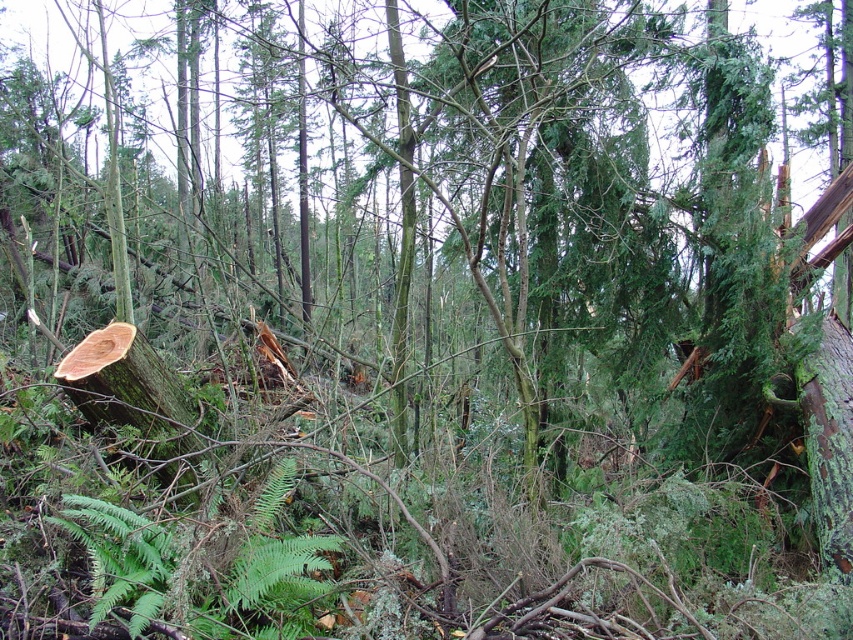
You are a hiker who has just entered the forest and sees the green rough tree trunk at lower left and the green rough bark tree trunk at right. Which tree trunk is positioned lower in the image?

The green rough tree trunk at lower left is positioned lower than the green rough bark tree trunk at right.

What is the relationship in size between the green fuzzy fern at center and the green rough tree trunk at lower left in the forest scene?

The green fuzzy fern at center is smaller in size compared to the green rough tree trunk at lower left.